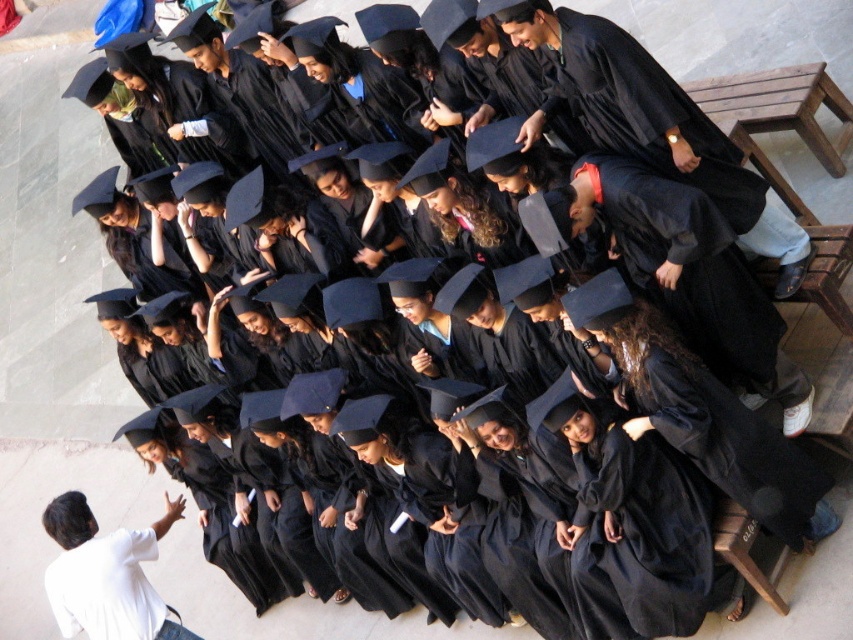
Question: Is matte black graduation gown at center thinner than matte black robe at center?

Choices:
 (A) no
 (B) yes

Answer: (B)

Question: Which object is positioned closest to the matte black robe at center?

Choices:
 (A) white matte shirt at lower left
 (B) matte black graduation gown at center

Answer: (B)

Question: Is matte black graduation gown at center further to the viewer compared to white matte shirt at lower left?

Choices:
 (A) yes
 (B) no

Answer: (B)

Question: Considering the real-world distances, which object is farthest from the white matte shirt at lower left?

Choices:
 (A) matte black graduation gown at center
 (B) matte black robe at center

Answer: (B)

Question: Is matte black graduation gown at center thinner than white matte shirt at lower left?

Choices:
 (A) yes
 (B) no

Answer: (B)

Question: Among these objects, which one is nearest to the camera?

Choices:
 (A) white matte shirt at lower left
 (B) matte black graduation gown at center
 (C) matte black robe at center

Answer: (B)